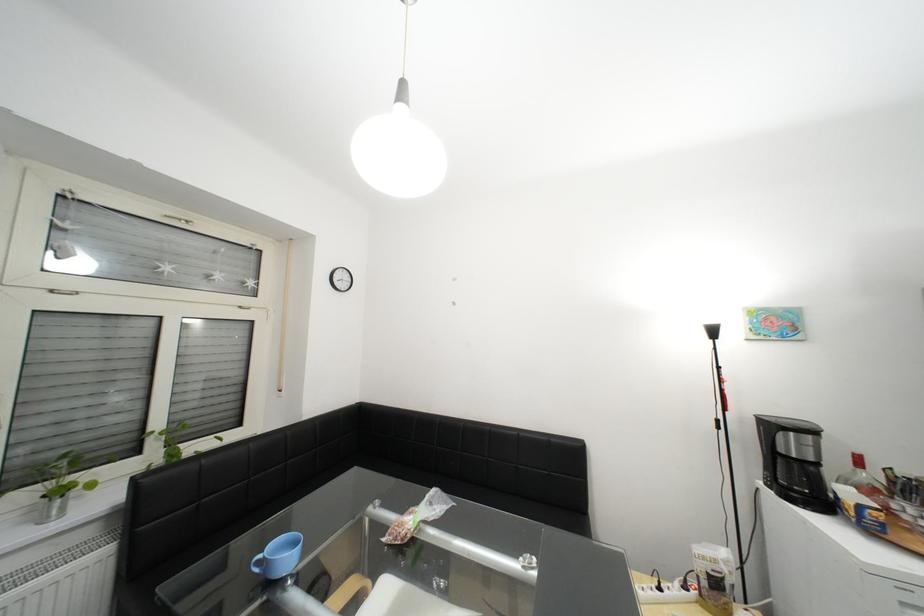
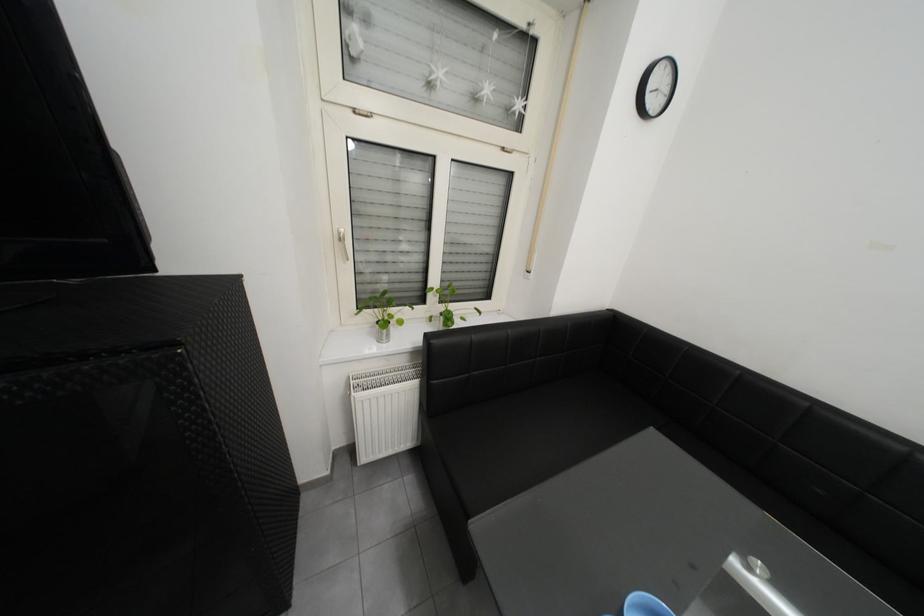
In the scene shown: How did the camera likely rotate?

The camera rotated toward left-down.